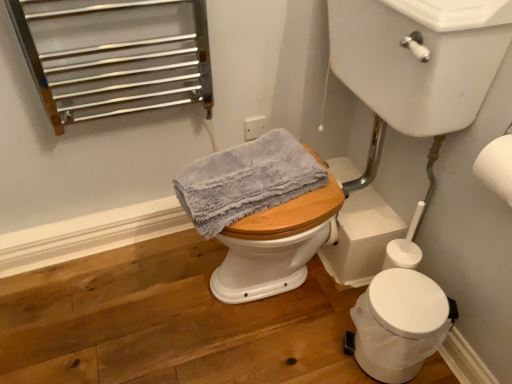
Question: From a real-world perspective, is white glossy sink at upper right over gray textured towel at center?

Choices:
 (A) no
 (B) yes

Answer: (B)

Question: Is white glossy sink at upper right at the right side of gray textured towel at center?

Choices:
 (A) no
 (B) yes

Answer: (B)

Question: Does white glossy sink at upper right lie behind gray textured towel at center?

Choices:
 (A) yes
 (B) no

Answer: (B)

Question: Is white glossy sink at upper right aimed at gray textured towel at center?

Choices:
 (A) no
 (B) yes

Answer: (B)

Question: Does white glossy sink at upper right have a greater width compared to gray textured towel at center?

Choices:
 (A) yes
 (B) no

Answer: (A)

Question: Would you say gray textured towel at center is inside or outside white plastic trash can at lower right?

Choices:
 (A) inside
 (B) outside

Answer: (B)

Question: From the image's perspective, is gray textured towel at center located above or below white plastic trash can at lower right?

Choices:
 (A) above
 (B) below

Answer: (A)

Question: Considering the positions of point (274, 168) and point (353, 311), is point (274, 168) closer or farther from the camera than point (353, 311)?

Choices:
 (A) farther
 (B) closer

Answer: (A)

Question: Looking at their shapes, would you say gray textured towel at center is wider or thinner than white plastic trash can at lower right?

Choices:
 (A) thin
 (B) wide

Answer: (B)

Question: Visually, is white matte toilet paper at upper right positioned to the left or to the right of white plastic trash can at lower right?

Choices:
 (A) right
 (B) left

Answer: (A)

Question: Considering the positions of white matte toilet paper at upper right and white plastic trash can at lower right in the image, is white matte toilet paper at upper right wider or thinner than white plastic trash can at lower right?

Choices:
 (A) wide
 (B) thin

Answer: (B)

Question: Is point (504, 150) closer or farther from the camera than point (415, 279)?

Choices:
 (A) closer
 (B) farther

Answer: (A)

Question: From the image's perspective, is white matte toilet paper at upper right above or below white plastic trash can at lower right?

Choices:
 (A) above
 (B) below

Answer: (A)

Question: Does point (497, 193) appear closer or farther from the camera than point (320, 172)?

Choices:
 (A) closer
 (B) farther

Answer: (A)

Question: In the image, is white matte toilet paper at upper right positioned in front of or behind gray textured towel at center?

Choices:
 (A) behind
 (B) front

Answer: (B)